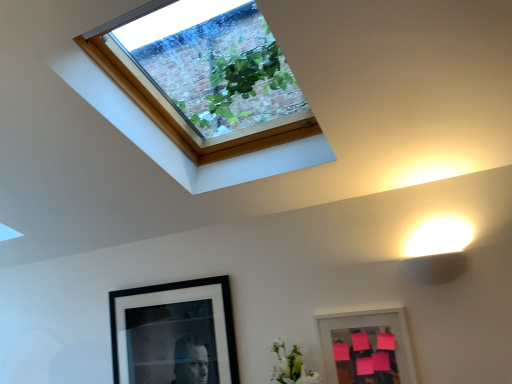
Question: Considering the relative sizes of pink matte picture frame at lower right, the 1th picture frame when ordered from front to back, and black matte picture frame at lower left, which is the 1th picture frame in back-to-front order, in the image provided, is pink matte picture frame at lower right, the 1th picture frame when ordered from front to back, wider than black matte picture frame at lower left, which is the 1th picture frame in back-to-front order,?

Choices:
 (A) yes
 (B) no

Answer: (B)

Question: Is pink matte picture frame at lower right, the 1th picture frame when ordered from right to left, to the right of black matte picture frame at lower left, the second picture frame in the front-to-back sequence, from the viewer's perspective?

Choices:
 (A) no
 (B) yes

Answer: (B)

Question: Can you confirm if pink matte picture frame at lower right, the 1th picture frame when ordered from right to left, is smaller than black matte picture frame at lower left, which is the second picture frame from right to left?

Choices:
 (A) no
 (B) yes

Answer: (B)

Question: Is pink matte picture frame at lower right, which is the second picture frame in left-to-right order, not inside black matte picture frame at lower left, the second picture frame in the front-to-back sequence?

Choices:
 (A) yes
 (B) no

Answer: (A)

Question: Considering the relative sizes of pink matte picture frame at lower right, which is the second picture frame in left-to-right order, and black matte picture frame at lower left, which is the second picture frame from right to left, in the image provided, is pink matte picture frame at lower right, which is the second picture frame in left-to-right order, bigger than black matte picture frame at lower left, which is the second picture frame from right to left,?

Choices:
 (A) yes
 (B) no

Answer: (B)

Question: Can you confirm if pink matte picture frame at lower right, which is the second picture frame in left-to-right order, is thinner than black matte picture frame at lower left, which is the second picture frame from right to left?

Choices:
 (A) yes
 (B) no

Answer: (A)

Question: Does white matte flower at lower center have a lesser height compared to clear glass window at upper center?

Choices:
 (A) no
 (B) yes

Answer: (B)

Question: Does white matte flower at lower center have a greater width compared to clear glass window at upper center?

Choices:
 (A) yes
 (B) no

Answer: (B)

Question: Is white matte flower at lower center not near clear glass window at upper center?

Choices:
 (A) yes
 (B) no

Answer: (A)

Question: From a real-world perspective, is white matte flower at lower center under clear glass window at upper center?

Choices:
 (A) yes
 (B) no

Answer: (A)

Question: Does white matte flower at lower center lie in front of clear glass window at upper center?

Choices:
 (A) yes
 (B) no

Answer: (B)

Question: Is white matte flower at lower center positioned with its back to clear glass window at upper center?

Choices:
 (A) yes
 (B) no

Answer: (B)

Question: Considering the relative sizes of black matte picture frame at lower left, the first picture frame when ordered from left to right, and pink matte picture frame at lower right, the second picture frame viewed from the back, in the image provided, is black matte picture frame at lower left, the first picture frame when ordered from left to right, wider than pink matte picture frame at lower right, the second picture frame viewed from the back,?

Choices:
 (A) yes
 (B) no

Answer: (A)